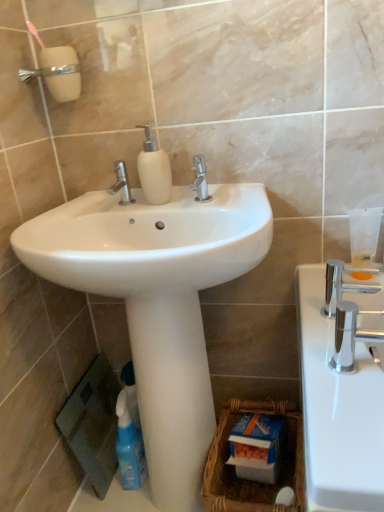
Question: Can you confirm if white matte soap dispenser at center is smaller than polished chrome faucet at center, which is counted as the first tap, starting from the top?

Choices:
 (A) yes
 (B) no

Answer: (B)

Question: Is white matte soap dispenser at center oriented towards polished chrome faucet at center, the 2th tap viewed from the left?

Choices:
 (A) no
 (B) yes

Answer: (A)

Question: Does white matte soap dispenser at center have a lesser height compared to polished chrome faucet at center, the 2th tap viewed from the left?

Choices:
 (A) no
 (B) yes

Answer: (A)

Question: Is the position of white matte soap dispenser at center more distant than that of polished chrome faucet at center, the 2th tap viewed from the left?

Choices:
 (A) no
 (B) yes

Answer: (B)

Question: From a real-world perspective, is white matte soap dispenser at center positioned over polished chrome faucet at center, which is counted as the first tap, starting from the top, based on gravity?

Choices:
 (A) yes
 (B) no

Answer: (A)

Question: From a real-world perspective, relative to blue plastic spray bottle at lower left, is polished chrome faucet at center, which is the second tap in top-to-bottom order, vertically above or below?

Choices:
 (A) above
 (B) below

Answer: (A)

Question: In terms of width, does polished chrome faucet at center, arranged as the first tap when viewed from the left, look wider or thinner when compared to blue plastic spray bottle at lower left?

Choices:
 (A) wide
 (B) thin

Answer: (B)

Question: In terms of height, does polished chrome faucet at center, arranged as the first tap when viewed from the left, look taller or shorter compared to blue plastic spray bottle at lower left?

Choices:
 (A) tall
 (B) short

Answer: (B)

Question: Is point (125, 181) positioned closer to the camera than point (137, 483)?

Choices:
 (A) farther
 (B) closer

Answer: (B)

Question: Would you say woven brown basket at lower center is to the left or to the right of polished chrome faucet at right in the picture?

Choices:
 (A) left
 (B) right

Answer: (A)

Question: From the image's perspective, is woven brown basket at lower center above or below polished chrome faucet at right?

Choices:
 (A) below
 (B) above

Answer: (A)

Question: Looking at the image, does woven brown basket at lower center seem bigger or smaller compared to polished chrome faucet at right?

Choices:
 (A) small
 (B) big

Answer: (B)

Question: From their relative heights in the image, would you say woven brown basket at lower center is taller or shorter than polished chrome faucet at right?

Choices:
 (A) short
 (B) tall

Answer: (B)

Question: Choose the correct answer: Is polished chrome faucet at center, the 2th tap when ordered from front to back, inside polished chrome faucet at right or outside it?

Choices:
 (A) outside
 (B) inside

Answer: (A)

Question: Considering their positions, is polished chrome faucet at center, which is the second tap in back-to-front order, located in front of or behind polished chrome faucet at right?

Choices:
 (A) front
 (B) behind

Answer: (B)